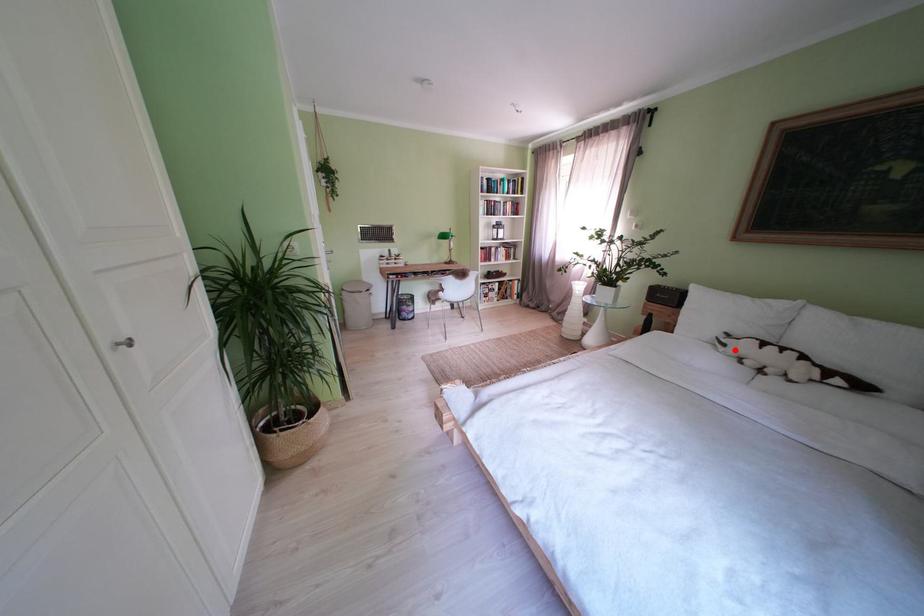
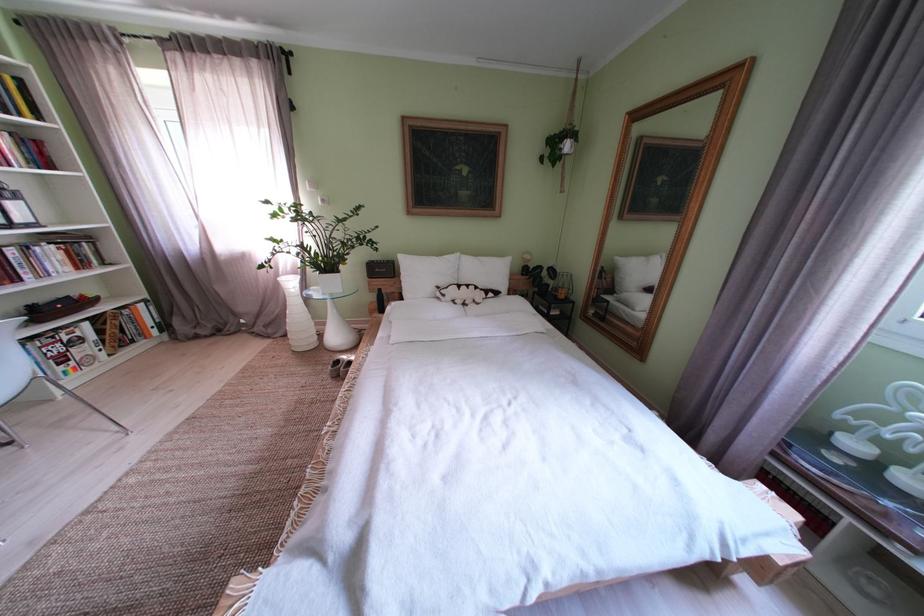
Question: I am providing you with two images of the same scene from different viewpoints. A red point is shown in image1. For the corresponding object point in image2, is it positioned nearer or farther from the camera?

Choices:
 (A) Nearer
 (B) Farther

Answer: (A)